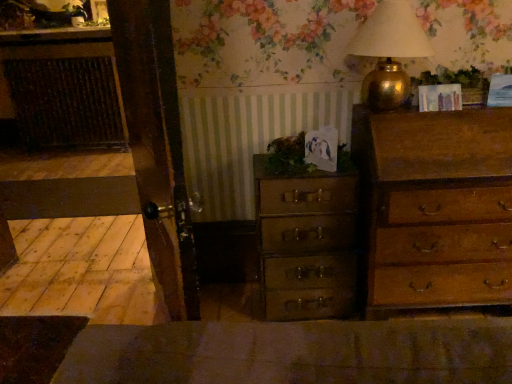
Question: In terms of width, does wooden chest of drawers at center, which is counted as the second chest of drawers, starting from the right, look wider or thinner when compared to green leafy plant at center, the first plant from the bottom?

Choices:
 (A) wide
 (B) thin

Answer: (A)

Question: In the image, is wooden chest of drawers at center, which is counted as the second chest of drawers, starting from the right, positioned in front of or behind green leafy plant at center, the first plant positioned from the left?

Choices:
 (A) front
 (B) behind

Answer: (B)

Question: Based on their relative distances, which object is farther from the green leafy plant at center, which is the second plant from top to bottom?

Choices:
 (A) wooden chest of drawers at right, positioned as the 1th chest of drawers in right-to-left order
 (B) gold metallic table lamp at upper right
 (C) rustic wicker cabinet at left
 (D) wooden chest of drawers at center, which is the first chest of drawers in left-to-right order
 (E) green leafy plant at upper right, acting as the 1th plant starting from the right

Answer: (C)

Question: Considering the real-world distances, which object is farthest from the rustic wicker cabinet at left?

Choices:
 (A) gold metallic table lamp at upper right
 (B) green leafy plant at center, the first plant from the bottom
 (C) wooden chest of drawers at center, which is counted as the second chest of drawers, starting from the right
 (D) wooden chest of drawers at right, positioned as the 1th chest of drawers in right-to-left order
 (E) green leafy plant at upper right, acting as the 1th plant starting from the right

Answer: (E)